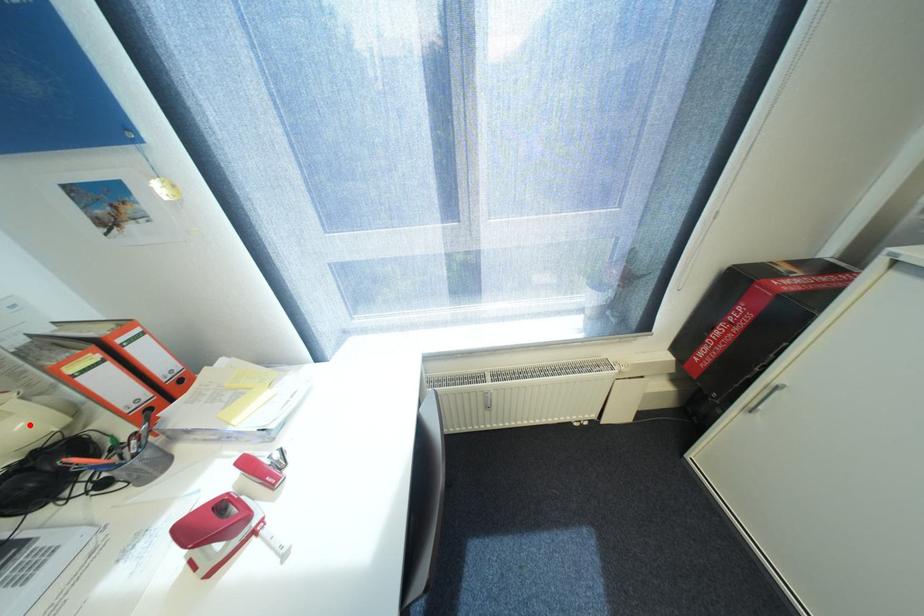
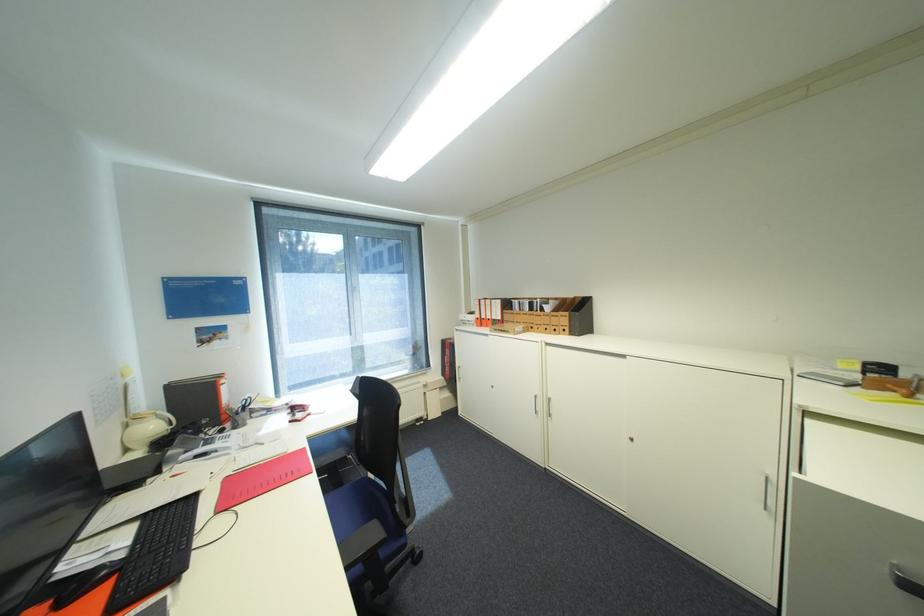
Where in the second image is the point corresponding to the highlighted location from the first image?

(161, 427)